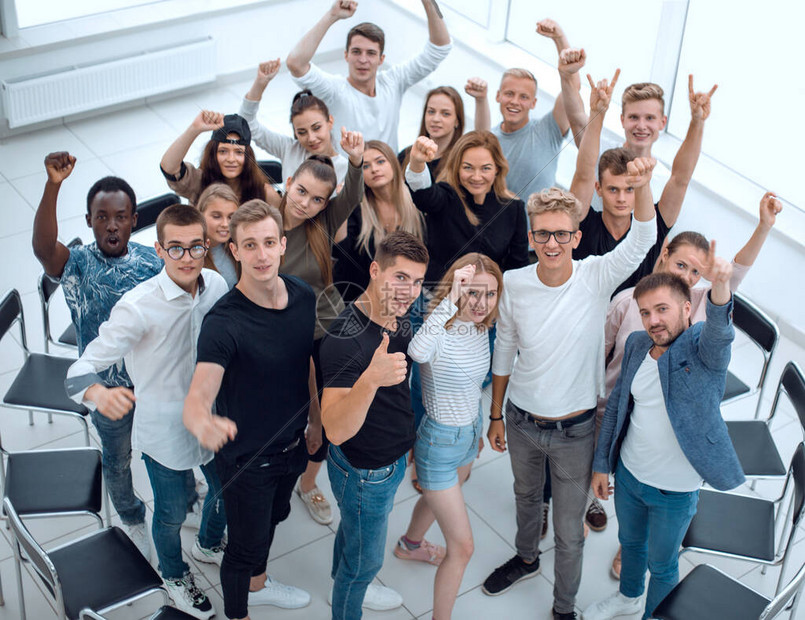
What are the coordinates of `chairs` in the screenshot? It's located at (716, 590), (729, 537), (770, 456), (729, 381), (97, 568), (168, 612), (80, 484), (43, 366), (55, 322).